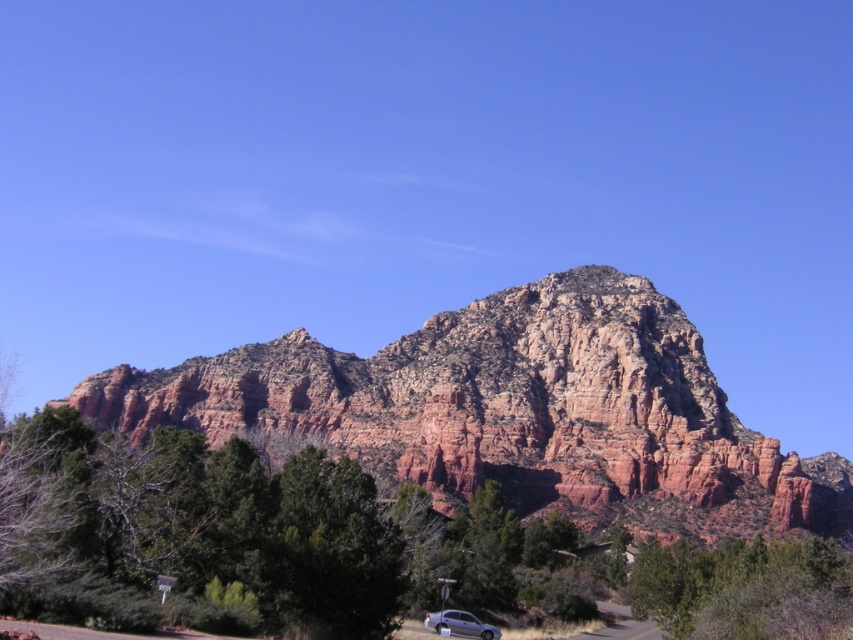
What do you see at coordinates (512, 412) in the screenshot? I see `rustic rock formation at center` at bounding box center [512, 412].

Which is above, rustic rock formation at center or green leafy tree at lower right?

rustic rock formation at center

Find the location of a particular element. The height and width of the screenshot is (640, 853). rustic rock formation at center is located at coordinates (512, 412).

You are a GUI agent. You are given a task and a screenshot of the screen. Output one action in this format:
    pyautogui.click(x=<x>, y=<y>)
    Task: Click on the rustic rock formation at center
    Image resolution: width=853 pixels, height=640 pixels.
    Given the screenshot: What is the action you would take?
    pyautogui.click(x=512, y=412)

Who is more distant from viewer, (764,492) or (490,627)?

The point (764,492) is more distant.

From the picture: Which is more to the left, rustic rock formation at center or silver metallic car at lower center?

silver metallic car at lower center

Who is more forward, (231, 422) or (424, 625)?

Positioned in front is point (424, 625).

The image size is (853, 640). Find the location of `rustic rock formation at center`. rustic rock formation at center is located at coordinates (512, 412).

In the scene shown: Is green leafy tree at lower right above silver metallic car at lower center?

Yes.

What do you see at coordinates (744, 588) in the screenshot? The height and width of the screenshot is (640, 853). I see `green leafy tree at lower right` at bounding box center [744, 588].

Is point (788, 541) more distant than point (465, 634)?

Yes.

Find the location of a particular element. The height and width of the screenshot is (640, 853). green leafy tree at lower right is located at coordinates (744, 588).